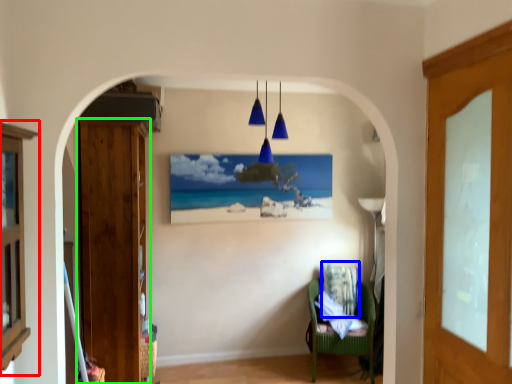
Question: Which object is the farthest from cabinetry (highlighted by a red box)? Choose among these: pillow (highlighted by a blue box) or door (highlighted by a green box).

Choices:
 (A) pillow
 (B) door

Answer: (A)